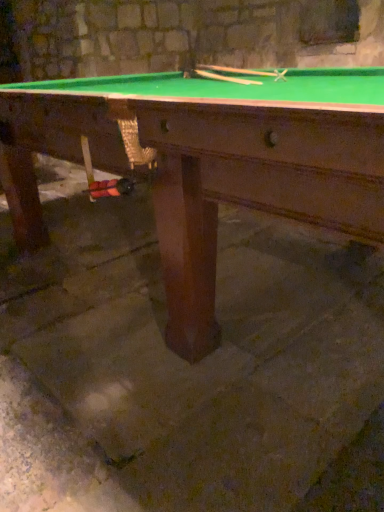
At what (x,y) coordinates should I click in order to perform the action: click on wooden smooth cue at upper center, positioned as the 2th cue in left-to-right order. Please return your answer as a coordinate pair (x, y). This screenshot has height=512, width=384. Looking at the image, I should click on (236, 70).

Locate an element on the screen. wooden smooth cue at upper center, acting as the first cue starting from the left is located at coordinates (225, 78).

In order to click on brown stone concrete at center in this screenshot , I will do `click(207, 357)`.

Is wooden smooth cue at upper center, acting as the first cue starting from the left, shorter than wooden smooth cue at upper center, positioned as the 2th cue in left-to-right order?

Correct, wooden smooth cue at upper center, acting as the first cue starting from the left, is not as tall as wooden smooth cue at upper center, positioned as the 2th cue in left-to-right order.

From the picture: Is wooden smooth cue at upper center, which is the 2th cue in right-to-left order, not inside wooden smooth cue at upper center, positioned as the 2th cue in left-to-right order?

Absolutely, wooden smooth cue at upper center, which is the 2th cue in right-to-left order, is external to wooden smooth cue at upper center, positioned as the 2th cue in left-to-right order.

From the image's perspective, which is below, wooden smooth cue at upper center, acting as the first cue starting from the left, or wooden smooth cue at upper center, positioned as the 2th cue in left-to-right order?

wooden smooth cue at upper center, acting as the first cue starting from the left, appears lower in the image.

From a real-world perspective, is wooden smooth cue at upper center, which is the 2th cue in right-to-left order, above or below wooden smooth cue at upper center, positioned as the 2th cue in left-to-right order?

wooden smooth cue at upper center, which is the 2th cue in right-to-left order, is situated lower than wooden smooth cue at upper center, positioned as the 2th cue in left-to-right order, in the real world.

From the picture: Which of these two, wooden smooth cue at upper center, arranged as the 1th cue when viewed from the right, or wooden smooth cue at upper center, which is the 2th cue in right-to-left order, is thinner?

With smaller width is wooden smooth cue at upper center, which is the 2th cue in right-to-left order.

Which is nearer, (212, 68) or (197, 70)?

Point (212, 68).

What's the angular difference between wooden smooth cue at upper center, arranged as the 1th cue when viewed from the right, and wooden smooth cue at upper center, which is the 2th cue in right-to-left order,'s facing directions?

2.21 degrees separate the facing orientations of wooden smooth cue at upper center, arranged as the 1th cue when viewed from the right, and wooden smooth cue at upper center, which is the 2th cue in right-to-left order.

Based on the photo, can you see wooden smooth cue at upper center, arranged as the 1th cue when viewed from the right, touching wooden smooth cue at upper center, which is the 2th cue in right-to-left order?

No, wooden smooth cue at upper center, arranged as the 1th cue when viewed from the right, is not beside wooden smooth cue at upper center, which is the 2th cue in right-to-left order.

From the image's perspective, which one is positioned lower, wooden smooth cue at upper center, which is the 2th cue in right-to-left order, or brown stone concrete at center?

brown stone concrete at center appears lower in the image.

Considering the relative sizes of wooden smooth cue at upper center, which is the 2th cue in right-to-left order, and brown stone concrete at center in the image provided, is wooden smooth cue at upper center, which is the 2th cue in right-to-left order, thinner than brown stone concrete at center?

Indeed, wooden smooth cue at upper center, which is the 2th cue in right-to-left order, has a lesser width compared to brown stone concrete at center.

Can you confirm if wooden smooth cue at upper center, acting as the first cue starting from the left, is positioned to the right of brown stone concrete at center?

In fact, wooden smooth cue at upper center, acting as the first cue starting from the left, is to the left of brown stone concrete at center.

Is point (214, 79) positioned before point (139, 476)?

That is False.

In the scene shown: Does brown stone concrete at center lie in front of wooden smooth cue at upper center, which is the 2th cue in right-to-left order?

Yes, brown stone concrete at center is closer to the viewer.

From a real-world perspective, is brown stone concrete at center on top of wooden smooth cue at upper center, which is the 2th cue in right-to-left order?

Incorrect, from a real-world perspective, brown stone concrete at center is lower than wooden smooth cue at upper center, which is the 2th cue in right-to-left order.

Could you tell me if brown stone concrete at center is turned towards wooden smooth cue at upper center, acting as the first cue starting from the left?

No, brown stone concrete at center does not turn towards wooden smooth cue at upper center, acting as the first cue starting from the left.

Is brown stone concrete at center with wooden smooth cue at upper center, acting as the first cue starting from the left?

No, brown stone concrete at center is not making contact with wooden smooth cue at upper center, acting as the first cue starting from the left.

Is point (337, 409) closer to camera compared to point (262, 73)?

Yes, point (337, 409) is in front of point (262, 73).

Is the depth of brown stone concrete at center greater than that of wooden smooth cue at upper center, arranged as the 1th cue when viewed from the right?

No, it is in front of wooden smooth cue at upper center, arranged as the 1th cue when viewed from the right.

Looking at this image, which of these two, brown stone concrete at center or wooden smooth cue at upper center, positioned as the 2th cue in left-to-right order, is bigger?

brown stone concrete at center.

How many degrees apart are the facing directions of brown stone concrete at center and wooden smooth cue at upper center, positioned as the 2th cue in left-to-right order?

They differ by 62.5 degrees in their facing directions.

Does wooden smooth cue at upper center, arranged as the 1th cue when viewed from the right, come behind brown stone concrete at center?

Yes, wooden smooth cue at upper center, arranged as the 1th cue when viewed from the right, is behind brown stone concrete at center.

How far apart are wooden smooth cue at upper center, positioned as the 2th cue in left-to-right order, and brown stone concrete at center?

wooden smooth cue at upper center, positioned as the 2th cue in left-to-right order, is 3.95 feet away from brown stone concrete at center.

Which object is positioned more to the left, wooden smooth cue at upper center, arranged as the 1th cue when viewed from the right, or brown stone concrete at center?

brown stone concrete at center is more to the left.

How many degrees apart are the facing directions of wooden smooth cue at upper center, arranged as the 1th cue when viewed from the right, and brown stone concrete at center?

The angular difference between wooden smooth cue at upper center, arranged as the 1th cue when viewed from the right, and brown stone concrete at center is 62.5 degrees.

Image resolution: width=384 pixels, height=512 pixels. I want to click on cue that appears above the wooden smooth cue at upper center, acting as the first cue starting from the left (from the image's perspective), so click(x=236, y=70).

Image resolution: width=384 pixels, height=512 pixels. Find the location of `cue to the right of wooden smooth cue at upper center, acting as the first cue starting from the left`. cue to the right of wooden smooth cue at upper center, acting as the first cue starting from the left is located at coordinates (236, 70).

Which object lies further to the anchor point brown stone concrete at center, wooden smooth cue at upper center, acting as the first cue starting from the left, or wooden smooth cue at upper center, positioned as the 2th cue in left-to-right order?

wooden smooth cue at upper center, positioned as the 2th cue in left-to-right order.

Estimate the real-world distances between objects in this image. Which object is further from brown stone concrete at center, wooden smooth cue at upper center, arranged as the 1th cue when viewed from the right, or wooden smooth cue at upper center, acting as the first cue starting from the left?

wooden smooth cue at upper center, arranged as the 1th cue when viewed from the right.

Estimate the real-world distances between objects in this image. Which object is closer to wooden smooth cue at upper center, arranged as the 1th cue when viewed from the right, wooden smooth cue at upper center, acting as the first cue starting from the left, or brown stone concrete at center?

wooden smooth cue at upper center, acting as the first cue starting from the left.

In the scene shown: When comparing their distances from wooden smooth cue at upper center, which is the 2th cue in right-to-left order, does wooden smooth cue at upper center, arranged as the 1th cue when viewed from the right, or brown stone concrete at center seem closer?

The object closer to wooden smooth cue at upper center, which is the 2th cue in right-to-left order, is wooden smooth cue at upper center, arranged as the 1th cue when viewed from the right.

Which object lies nearer to the anchor point wooden smooth cue at upper center, which is the 2th cue in right-to-left order, brown stone concrete at center or wooden smooth cue at upper center, arranged as the 1th cue when viewed from the right?

wooden smooth cue at upper center, arranged as the 1th cue when viewed from the right, is positioned closer to the anchor wooden smooth cue at upper center, which is the 2th cue in right-to-left order.

When comparing their distances from wooden smooth cue at upper center, positioned as the 2th cue in left-to-right order, does brown stone concrete at center or wooden smooth cue at upper center, which is the 2th cue in right-to-left order, seem closer?

Among the two, wooden smooth cue at upper center, which is the 2th cue in right-to-left order, is located nearer to wooden smooth cue at upper center, positioned as the 2th cue in left-to-right order.

Locate an element on the screen. This screenshot has width=384, height=512. cue positioned between brown stone concrete at center and wooden smooth cue at upper center, arranged as the 1th cue when viewed from the right, from near to far is located at coordinates (x=225, y=78).